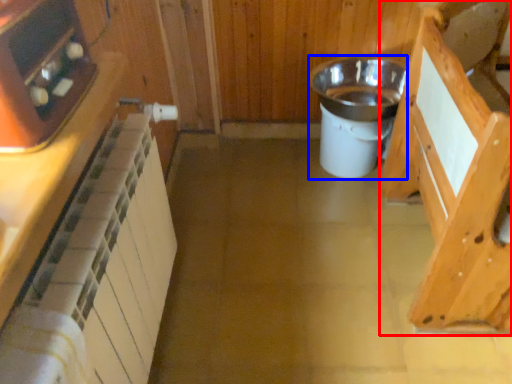
Question: Which object is further to the camera taking this photo, cabinetry (highlighted by a red box) or appliance (highlighted by a blue box)?

Choices:
 (A) cabinetry
 (B) appliance

Answer: (B)